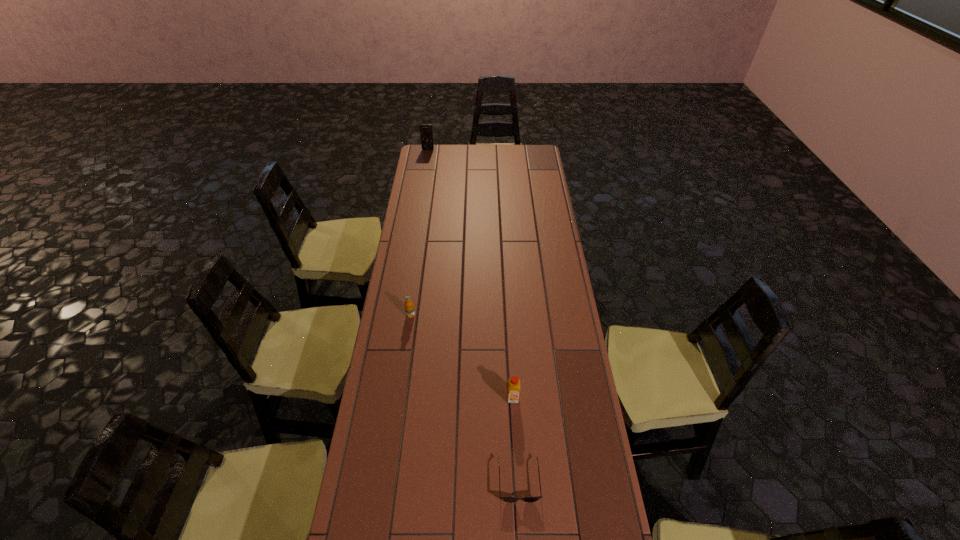
Find the location of `vacant point located on the label of the second farthest object`. vacant point located on the label of the second farthest object is located at coordinates point(409,328).

Where is `free spot located 0.080m on the front lenses of the sunglasses`? The width and height of the screenshot is (960, 540). free spot located 0.080m on the front lenses of the sunglasses is located at coordinates pos(522,534).

This screenshot has width=960, height=540. I want to click on object present at the far edge, so click(x=426, y=133).

At what (x,y) coordinates should I click in order to perform the action: click on cellular telephone located at the left edge. Please return your answer as a coordinate pair (x, y). The width and height of the screenshot is (960, 540). Looking at the image, I should click on (426, 133).

Find the location of a particular element. orange juice at the left edge is located at coordinates (409, 307).

This screenshot has height=540, width=960. I want to click on object at the far left corner, so click(x=426, y=133).

In order to click on vacant space at the far edge of the desktop in this screenshot , I will do `click(463, 152)`.

Locate an element on the screen. vacant space at the left edge of the desktop is located at coordinates (428, 293).

In order to click on free point at the right edge in this screenshot , I will do `click(550, 221)`.

Find the location of `blank space at the far left corner`. blank space at the far left corner is located at coordinates (425, 162).